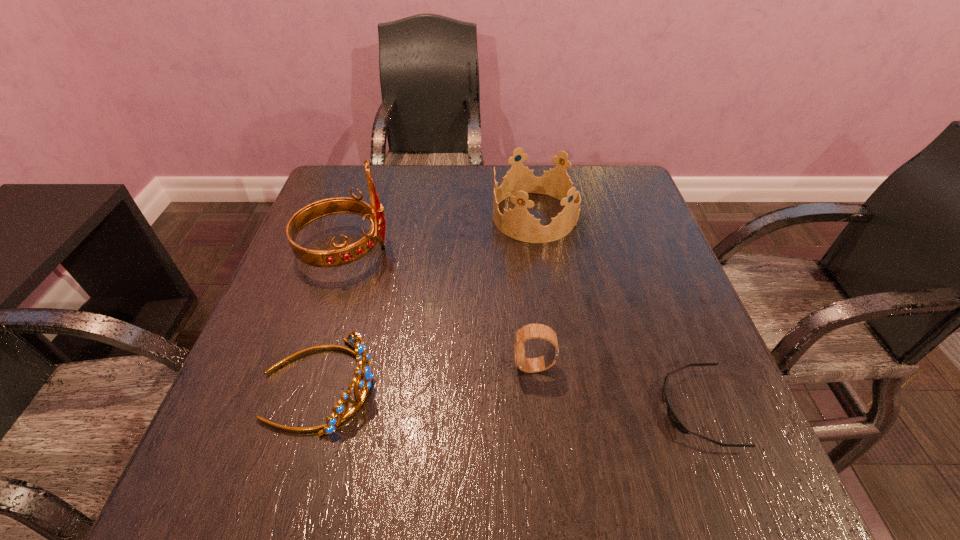
What are the coordinates of `the tallest object` in the screenshot? It's located at (343, 255).

Where is `the fourth shortest object`? The width and height of the screenshot is (960, 540). the fourth shortest object is located at coordinates (517, 223).

The height and width of the screenshot is (540, 960). In order to click on the rightmost tiara in this screenshot , I will do `click(517, 223)`.

Image resolution: width=960 pixels, height=540 pixels. In order to click on the shortest tiara in this screenshot , I will do `click(354, 339)`.

Identify the location of watch. The height and width of the screenshot is (540, 960). (531, 331).

The image size is (960, 540). Identify the location of sunglasses. (671, 414).

This screenshot has width=960, height=540. I want to click on the rightmost object, so click(x=671, y=414).

The image size is (960, 540). What are the coordinates of `free space located 0.250m on the front-facing side of the tallest object` in the screenshot? It's located at (500, 249).

Where is `free region located 0.180m on the front-facing side of the fourth shortest object`? The height and width of the screenshot is (540, 960). free region located 0.180m on the front-facing side of the fourth shortest object is located at coordinates (421, 217).

Locate an element on the screen. This screenshot has height=540, width=960. vacant space located 0.050m on the front-facing side of the fourth shortest object is located at coordinates (473, 217).